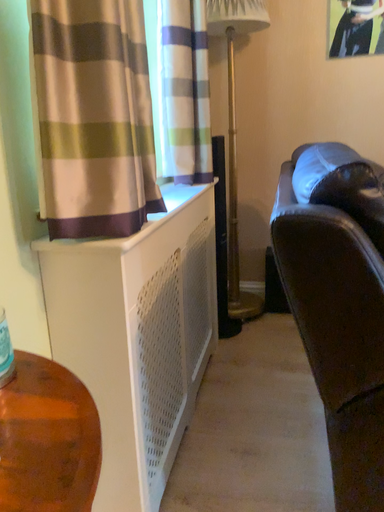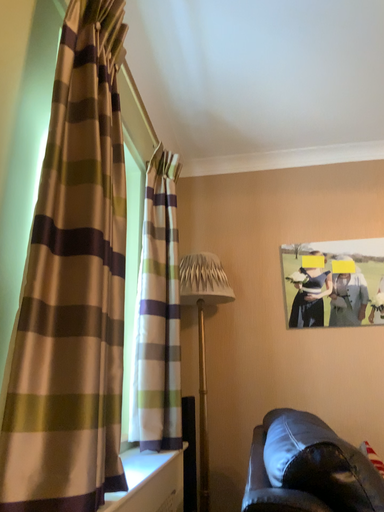
Question: Which way did the camera rotate in the video?

Choices:
 (A) rotated upward
 (B) rotated downward

Answer: (A)